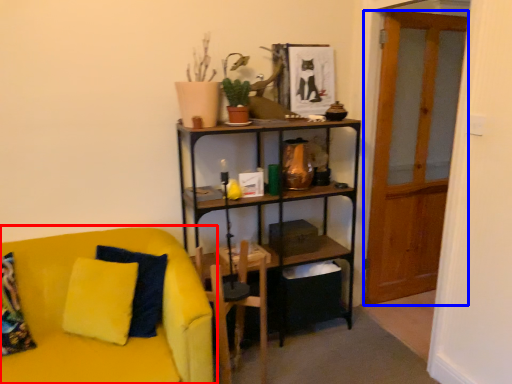
Question: Which object appears closest to the camera in this image, studio couch (highlighted by a red box) or glass door (highlighted by a blue box)?

Choices:
 (A) studio couch
 (B) glass door

Answer: (A)